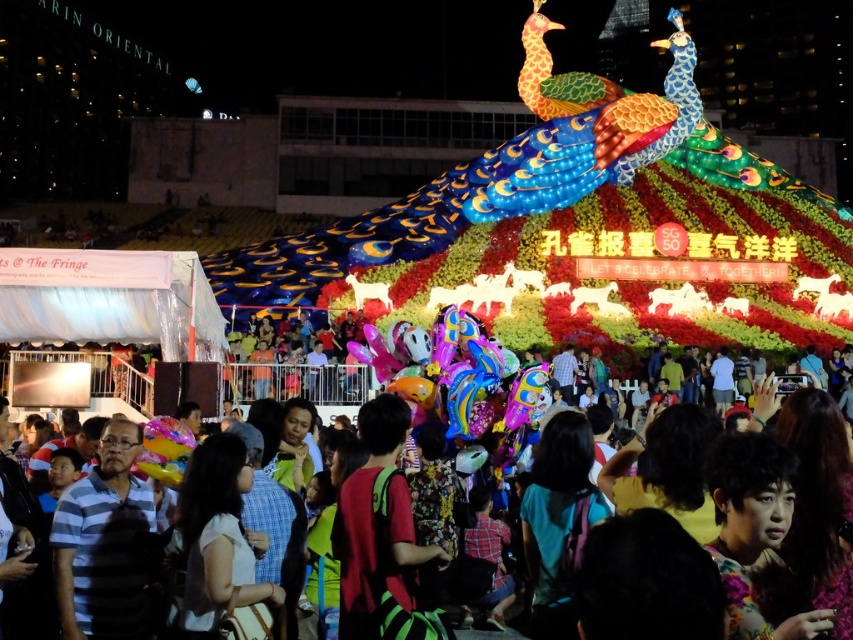
Question: Observing the image, what is the correct spatial positioning of striped cotton shirt at lower left in reference to multicolored fabric crowd at center?

Choices:
 (A) right
 (B) left

Answer: (B)

Question: Among these objects, which one is nearest to the camera?

Choices:
 (A) multicolored fabric crowd at center
 (B) striped cotton shirt at lower left

Answer: (A)

Question: Does striped cotton shirt at lower left appear on the right side of multicolored fabric crowd at center?

Choices:
 (A) yes
 (B) no

Answer: (B)

Question: Which point is closer to the camera?

Choices:
 (A) multicolored fabric crowd at center
 (B) striped cotton shirt at lower left

Answer: (A)

Question: Can you confirm if striped cotton shirt at lower left is wider than multicolored fabric crowd at center?

Choices:
 (A) yes
 (B) no

Answer: (B)